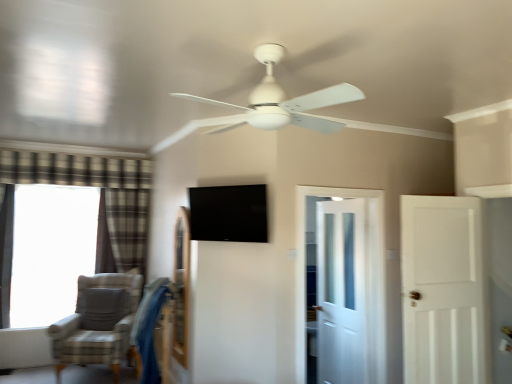
Question: Relative to black glossy tv at center, is white glossy door at center, which ranks as the first door in left-to-right order, in front or behind?

Choices:
 (A) front
 (B) behind

Answer: (B)

Question: Based on their sizes in the image, would you say white glossy door at center, acting as the 2th door starting from the right, is bigger or smaller than black glossy tv at center?

Choices:
 (A) small
 (B) big

Answer: (B)

Question: Based on their relative distances, which object is farther from the plaid fabric curtain at left, which is the second curtain from left to right?

Choices:
 (A) white glossy door at center, acting as the 2th door starting from the right
 (B) white matte door at right, which appears as the 1th door when viewed from the front
 (C) blue fabric swivel chair at lower left
 (D) white matte ceiling fan at center
 (E) black glossy tv at center

Answer: (B)

Question: Which object is positioned farthest from the white matte ceiling fan at center?

Choices:
 (A) gray fabric chair at lower left
 (B) plaid fabric curtain at left, arranged as the first curtain when viewed from the right
 (C) blue fabric swivel chair at lower left
 (D) white matte door at right, the first door when ordered from right to left
 (E) plaid fabric curtain at left, the first curtain positioned from the front

Answer: (E)